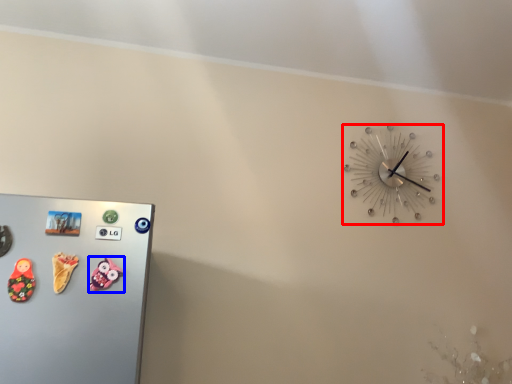
Question: Which object appears closest to the camera in this image, wall clock (highlighted by a red box) or toy (highlighted by a blue box)?

Choices:
 (A) wall clock
 (B) toy

Answer: (B)